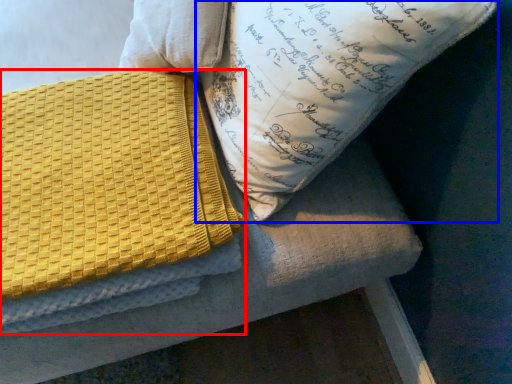
Question: Which object appears closest to the camera in this image, blanket (highlighted by a red box) or pillow (highlighted by a blue box)?

Choices:
 (A) blanket
 (B) pillow

Answer: (B)